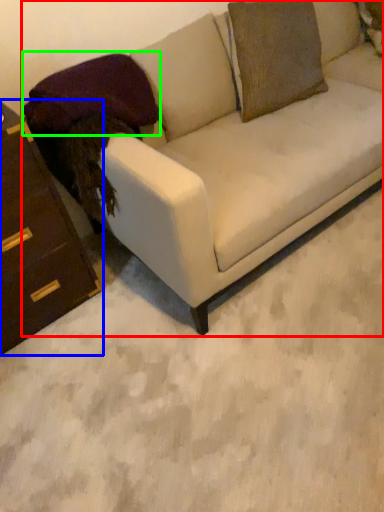
Question: Based on their relative distances, which object is nearer to studio couch (highlighted by a red box)? Choose from chest of drawers (highlighted by a blue box) and pillow (highlighted by a green box).

Choices:
 (A) chest of drawers
 (B) pillow

Answer: (B)